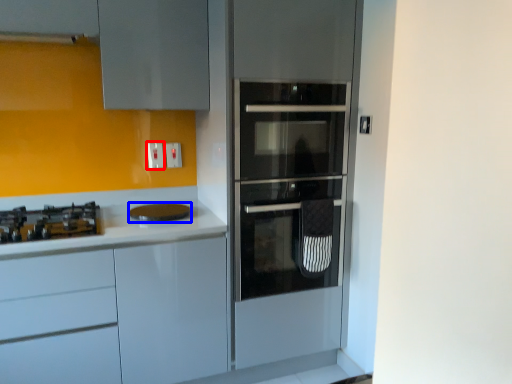
Question: Which object is closer to the camera taking this photo, electric outlet (highlighted by a red box) or home appliance (highlighted by a blue box)?

Choices:
 (A) electric outlet
 (B) home appliance

Answer: (B)